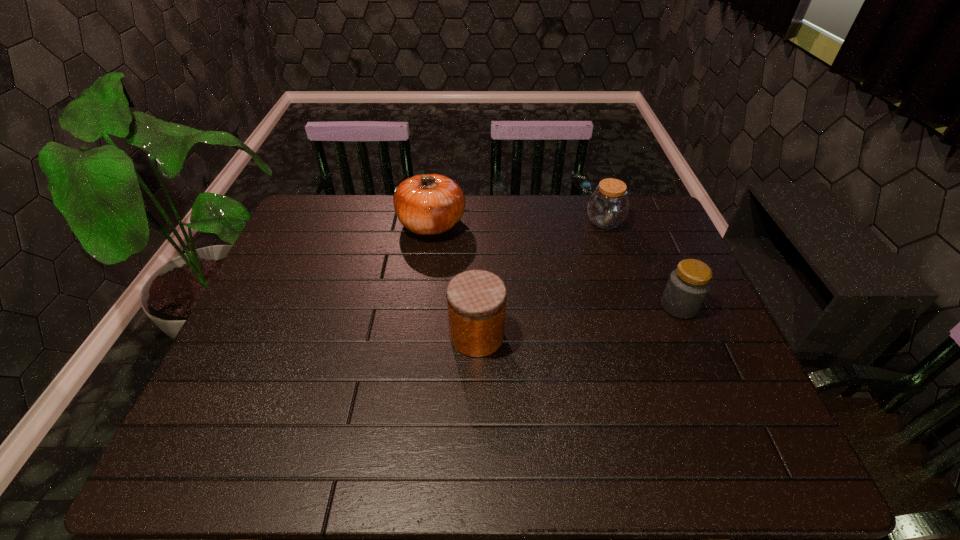
Locate an element on the screen. This screenshot has height=540, width=960. free region located 0.060m on the surface of the rightmost jar near the warning symbol is located at coordinates (638, 306).

Locate an element on the screen. The width and height of the screenshot is (960, 540). pumpkin at the far edge is located at coordinates (429, 204).

Find the location of a particular element. This screenshot has height=540, width=960. jar that is at the far edge is located at coordinates (607, 207).

Identify the location of object situated at the far right corner. The height and width of the screenshot is (540, 960). (607, 207).

Image resolution: width=960 pixels, height=540 pixels. In the image, there is a desktop. Identify the location of vacant space at the far edge. (367, 199).

The image size is (960, 540). What are the coordinates of `free space at the near edge of the desktop` in the screenshot? It's located at (366, 455).

Identify the location of vacant space at the left edge of the desktop. (335, 248).

At what (x,y) coordinates should I click in order to perform the action: click on vacant point at the right edge. Please return your answer as a coordinate pair (x, y). The width and height of the screenshot is (960, 540). Looking at the image, I should click on (706, 401).

The width and height of the screenshot is (960, 540). In the image, there is a desktop. Identify the location of vacant space at the far left corner. (309, 214).

In the image, there is a desktop. Identify the location of vacant space at the near left corner. (195, 440).